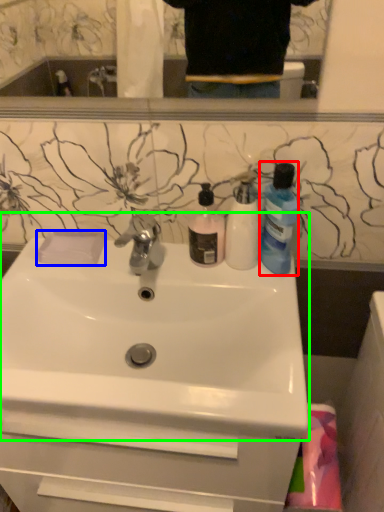
Question: Which object is the closest to the cleaning product (highlighted by a red box)? Choose among these: soap (highlighted by a blue box) or sink (highlighted by a green box).

Choices:
 (A) soap
 (B) sink

Answer: (B)